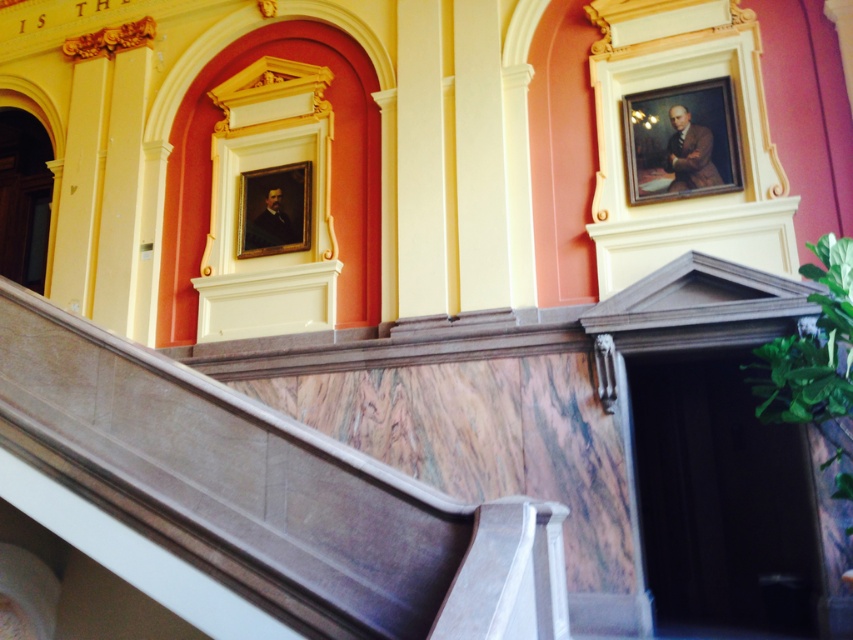
Question: In this image, where is marble stairs at center located relative to oil painting portrait at upper right?

Choices:
 (A) below
 (B) above

Answer: (A)

Question: Is oil painting portrait at upper right smaller than matte gold frame at upper center?

Choices:
 (A) yes
 (B) no

Answer: (B)

Question: Which point is closer to the camera?

Choices:
 (A) matte gold frame at upper center
 (B) oil painting portrait at upper right

Answer: (B)

Question: Is marble stairs at center to the right of matte gold frame at upper center from the viewer's perspective?

Choices:
 (A) no
 (B) yes

Answer: (B)

Question: Among these objects, which one is farthest from the camera?

Choices:
 (A) oil painting portrait at upper right
 (B) matte gold frame at upper center

Answer: (B)

Question: Estimate the real-world distances between objects in this image. Which object is farther from the marble stairs at center?

Choices:
 (A) matte gold frame at upper center
 (B) oil painting portrait at upper right

Answer: (B)